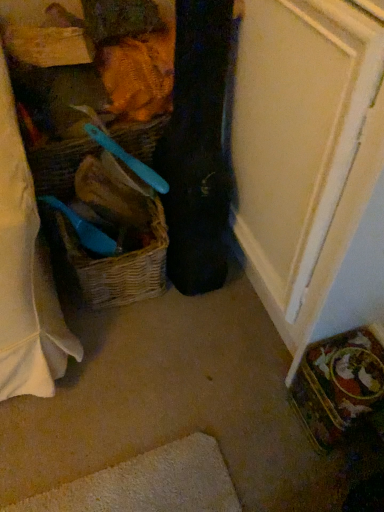
Question: Does woven straw basket at center have a greater width compared to black fabric guitar case at center?

Choices:
 (A) no
 (B) yes

Answer: (B)

Question: Considering the relative sizes of woven straw basket at center and black fabric guitar case at center in the image provided, is woven straw basket at center thinner than black fabric guitar case at center?

Choices:
 (A) no
 (B) yes

Answer: (A)

Question: Would you say woven straw basket at center is a long distance from black fabric guitar case at center?

Choices:
 (A) yes
 (B) no

Answer: (B)

Question: From a real-world perspective, is woven straw basket at center under black fabric guitar case at center?

Choices:
 (A) no
 (B) yes

Answer: (B)

Question: Does woven straw basket at center come behind black fabric guitar case at center?

Choices:
 (A) no
 (B) yes

Answer: (B)

Question: From a real-world perspective, is black fabric guitar case at center above or below woven brown picnic basket at left?

Choices:
 (A) below
 (B) above

Answer: (B)

Question: Considering the positions of point (183, 0) and point (158, 232), is point (183, 0) closer or farther from the camera than point (158, 232)?

Choices:
 (A) farther
 (B) closer

Answer: (B)

Question: Is black fabric guitar case at center in front of or behind woven brown picnic basket at left in the image?

Choices:
 (A) front
 (B) behind

Answer: (A)

Question: Do you think black fabric guitar case at center is within woven brown picnic basket at left, or outside of it?

Choices:
 (A) outside
 (B) inside

Answer: (A)

Question: Is black fabric guitar case at center taller or shorter than woven straw basket at center?

Choices:
 (A) tall
 (B) short

Answer: (A)

Question: Is black fabric guitar case at center to the left or to the right of woven straw basket at center in the image?

Choices:
 (A) left
 (B) right

Answer: (B)

Question: Looking at their shapes, would you say black fabric guitar case at center is wider or thinner than woven straw basket at center?

Choices:
 (A) wide
 (B) thin

Answer: (B)

Question: Considering the positions of black fabric guitar case at center and woven straw basket at center in the image, is black fabric guitar case at center bigger or smaller than woven straw basket at center?

Choices:
 (A) big
 (B) small

Answer: (A)

Question: From the image's perspective, is woven straw basket at center located above or below woven brown picnic basket at left?

Choices:
 (A) above
 (B) below

Answer: (A)

Question: Visually, is woven straw basket at center positioned to the left or to the right of woven brown picnic basket at left?

Choices:
 (A) right
 (B) left

Answer: (A)